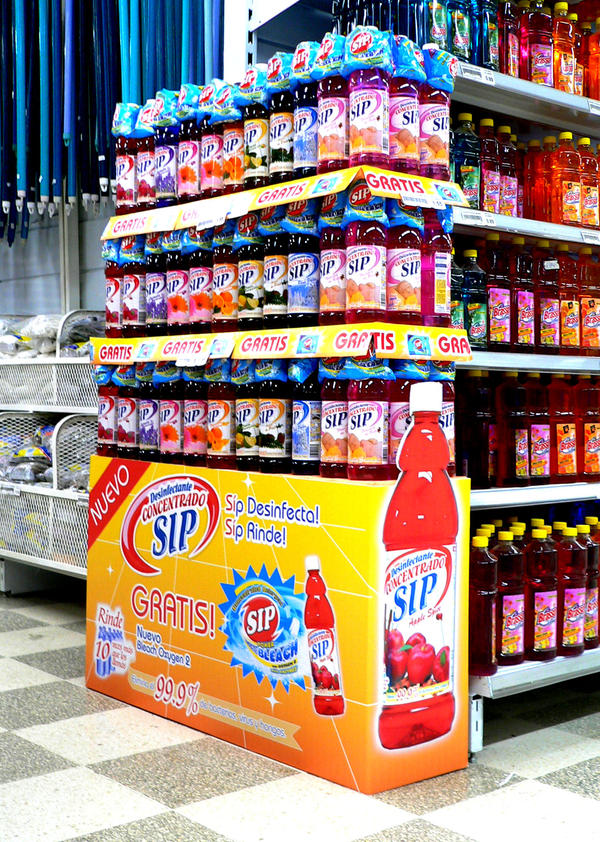
Where is `white metal shelving units`? white metal shelving units is located at coordinates (532, 669), (513, 498), (527, 355), (535, 87).